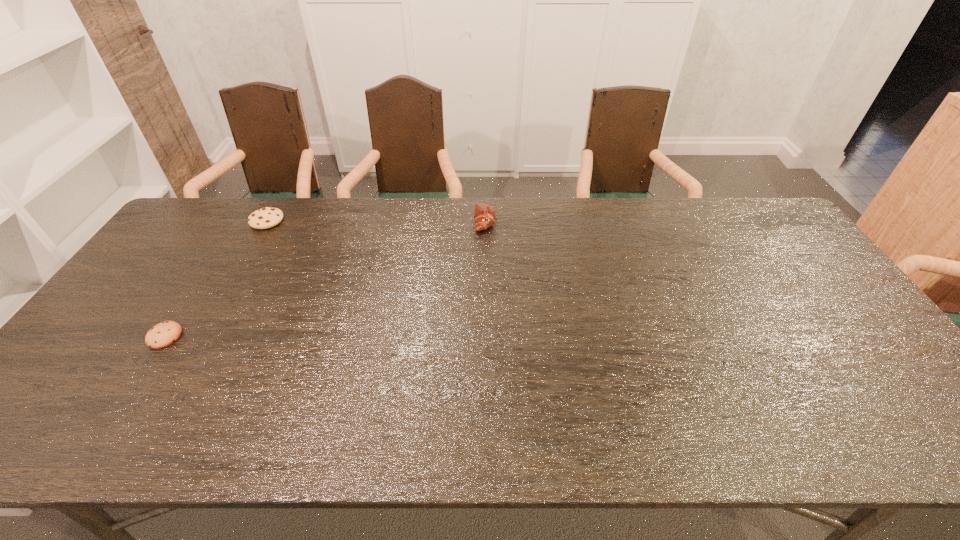
Where is `vacant space that satisfies the following two spatial constraints: 1. on the front side of the farther cookie; 2. on the left side of the tallest object`? This screenshot has height=540, width=960. vacant space that satisfies the following two spatial constraints: 1. on the front side of the farther cookie; 2. on the left side of the tallest object is located at coordinates (267, 221).

Find the location of `free location that satisfies the following two spatial constraints: 1. on the back side of the nearer cookie; 2. on the left side of the crescent roll`. free location that satisfies the following two spatial constraints: 1. on the back side of the nearer cookie; 2. on the left side of the crescent roll is located at coordinates (239, 221).

Image resolution: width=960 pixels, height=540 pixels. What are the coordinates of `vacant position in the image that satisfies the following two spatial constraints: 1. on the back side of the second tallest object; 2. on the left side of the shortest object` in the screenshot? It's located at (240, 220).